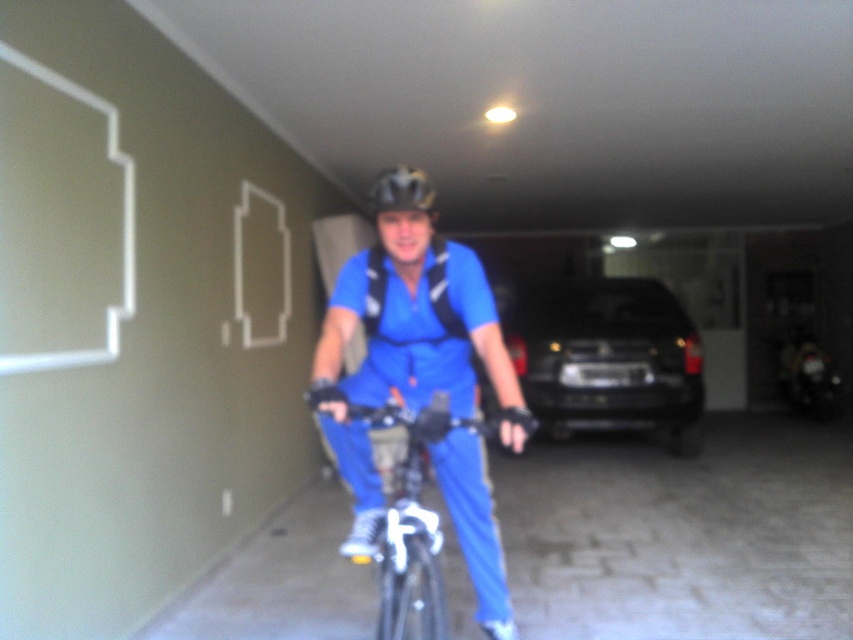
Question: Does blue fabric shirt at center have a lesser width compared to metallic silver bicycle at center?

Choices:
 (A) yes
 (B) no

Answer: (B)

Question: Is blue fabric shirt at center thinner than metallic silver bicycle at center?

Choices:
 (A) yes
 (B) no

Answer: (B)

Question: Among these objects, which one is nearest to the camera?

Choices:
 (A) black matte helmet at center
 (B) black matte suv at center
 (C) metallic silver bicycle at center

Answer: (C)

Question: Estimate the real-world distances between objects in this image. Which object is farther from the black matte helmet at center?

Choices:
 (A) black matte suv at center
 (B) metallic silver bicycle at center

Answer: (B)

Question: Which object is positioned closest to the black matte helmet at center?

Choices:
 (A) black matte suv at center
 (B) metallic silver bicycle at center

Answer: (A)

Question: Is the position of black matte suv at center less distant than that of metallic silver bicycle at center?

Choices:
 (A) yes
 (B) no

Answer: (B)